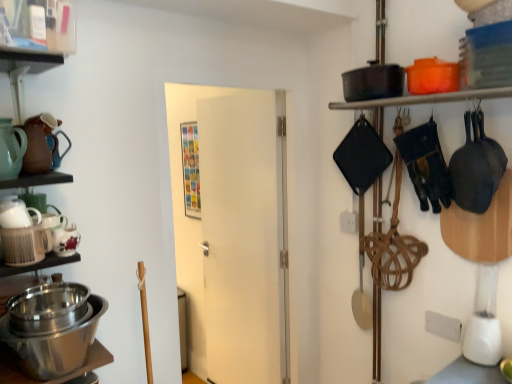
This screenshot has height=384, width=512. Find the location of `vacant space situated above white matte door at center (from a real-world perspective)`. vacant space situated above white matte door at center (from a real-world perspective) is located at coordinates (234, 72).